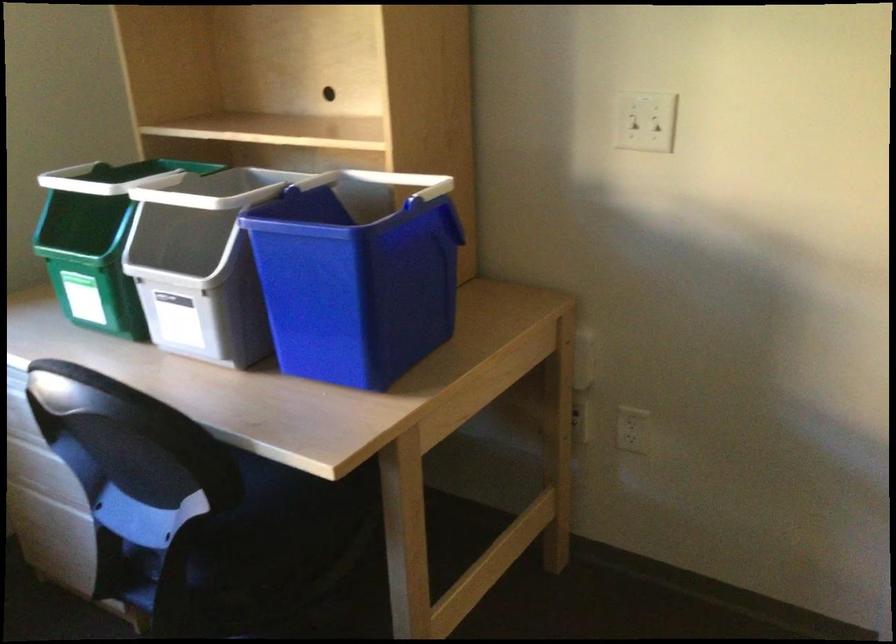
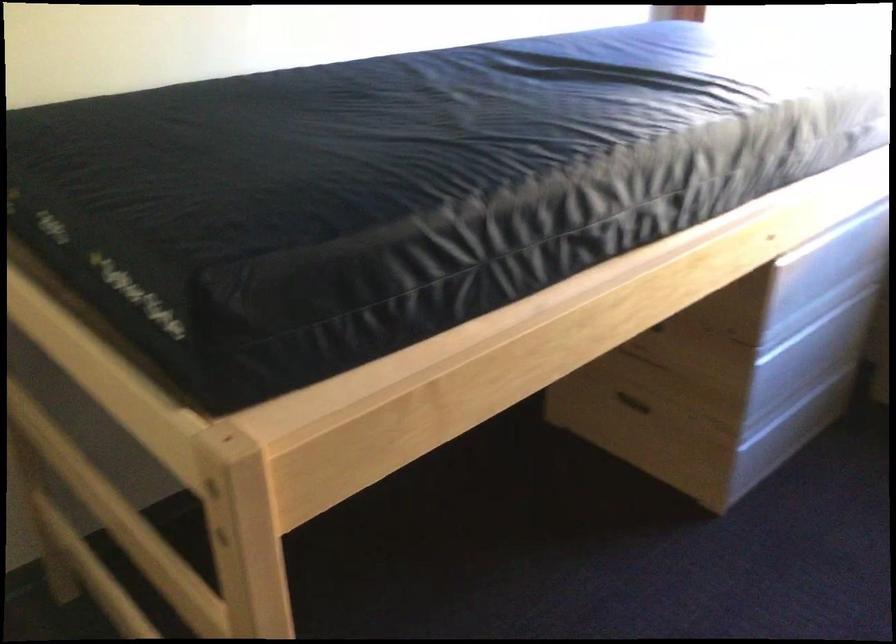
How did the camera likely rotate?

The camera rotated toward left-down.